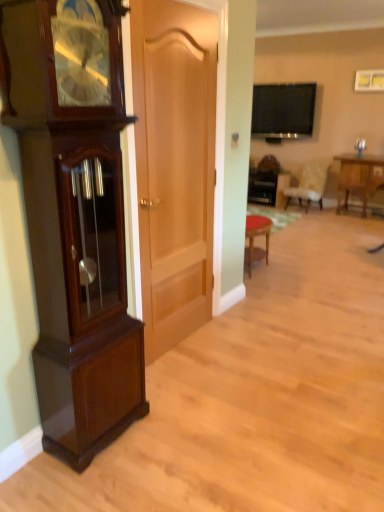
Where is `wooden table at center, which is counted as the first table, starting from the back`? The height and width of the screenshot is (512, 384). wooden table at center, which is counted as the first table, starting from the back is located at coordinates 267,187.

Identify the location of wooden table at right, marked as the second table in a back-to-front arrangement. The height and width of the screenshot is (512, 384). (358, 177).

Can you confirm if wooden table at right, the first table viewed from the front, is wider than mahogany wood grandfather clock at left?

Indeed, wooden table at right, the first table viewed from the front, has a greater width compared to mahogany wood grandfather clock at left.

From the image's perspective, is wooden table at right, the first table viewed from the front, below mahogany wood grandfather clock at left?

No, from the image's perspective, wooden table at right, the first table viewed from the front, is not below mahogany wood grandfather clock at left.

From a real-world perspective, which object stands above the other?

In real-world perspective, mahogany wood grandfather clock at left is above.

Can you tell me how much mahogany wood grandfather clock at left and flat-screen tv at upper center differ in facing direction?

There is a 93.2-degree angle between the facing directions of mahogany wood grandfather clock at left and flat-screen tv at upper center.

From the image's perspective, does mahogany wood grandfather clock at left appear lower than flat-screen tv at upper center?

Yes.

Which object is closer to the camera, mahogany wood grandfather clock at left or flat-screen tv at upper center?

mahogany wood grandfather clock at left is more forward.

Which object is positioned more to the left, mahogany wood grandfather clock at left or flat-screen tv at upper center?

From the viewer's perspective, mahogany wood grandfather clock at left appears more on the left side.

Considering the sizes of wooden table at right, the first table viewed from the right, and wooden table at center, which is counted as the first table, starting from the back, in the image, is wooden table at right, the first table viewed from the right, wider or thinner than wooden table at center, which is counted as the first table, starting from the back,?

Clearly, wooden table at right, the first table viewed from the right, has more width compared to wooden table at center, which is counted as the first table, starting from the back.

Which object is closer to the camera taking this photo, wooden table at right, which is the second table in left-to-right order, or wooden table at center, the 2th table positioned from the right?

Positioned in front is wooden table at right, which is the second table in left-to-right order.

Is wooden table at right, the first table viewed from the front, outside of wooden table at center, which is counted as the first table, starting from the back?

That's correct, wooden table at right, the first table viewed from the front, is outside of wooden table at center, which is counted as the first table, starting from the back.

How different are the orientations of wooden table at right, the first table viewed from the front, and wooden table at center, positioned as the first table in left-to-right order, in degrees?

The angle between the facing direction of wooden table at right, the first table viewed from the front, and the facing direction of wooden table at center, positioned as the first table in left-to-right order, is 3.08 degrees.

Between light brown wood door at center and wooden table at right, the first table viewed from the front, which one has more height?

light brown wood door at center is taller.

Is light brown wood door at center aimed at wooden table at right, marked as the second table in a back-to-front arrangement?

No, light brown wood door at center is not facing towards wooden table at right, marked as the second table in a back-to-front arrangement.

What's the angular difference between light brown wood door at center and wooden table at right, the first table viewed from the front,'s facing directions?

90 degrees.

Based on their positions, is wooden table at right, the first table viewed from the front, located to the left or right of light beige fabric chair at center?

wooden table at right, the first table viewed from the front, is positioned on light beige fabric chair at center's right side.

What's the angular difference between wooden table at right, the first table viewed from the front, and light beige fabric chair at center's facing directions?

wooden table at right, the first table viewed from the front, and light beige fabric chair at center are facing 10.9 degrees away from each other.

Between point (350, 188) and point (298, 199), which one is positioned in front?

The point (350, 188) is more forward.

Are wooden table at right, which is the second table in left-to-right order, and light beige fabric chair at center beside each other?

No, wooden table at right, which is the second table in left-to-right order, is not next to light beige fabric chair at center.

From the picture: Can you confirm if wooden table at center, positioned as the first table in left-to-right order, is taller than flat-screen tv at upper center?

No, wooden table at center, positioned as the first table in left-to-right order, is not taller than flat-screen tv at upper center.

Where is `television that appears on the right of wooden table at center, which appears as the second table when viewed from the front`? television that appears on the right of wooden table at center, which appears as the second table when viewed from the front is located at coordinates point(283,110).

From the image's perspective, is wooden table at center, positioned as the first table in left-to-right order, located above flat-screen tv at upper center?

No, from the image's perspective, wooden table at center, positioned as the first table in left-to-right order, is not on top of flat-screen tv at upper center.

Would you say flat-screen tv at upper center is part of wooden table at center, the 2th table positioned from the right,'s contents?

Definitely not — flat-screen tv at upper center is not inside wooden table at center, the 2th table positioned from the right.

Can you tell me how much wooden table at center, which appears as the second table when viewed from the front, and light brown wood door at center differ in facing direction?

86.9 degrees separate the facing orientations of wooden table at center, which appears as the second table when viewed from the front, and light brown wood door at center.

In the image, is wooden table at center, positioned as the first table in left-to-right order, on the left side or the right side of light brown wood door at center?

wooden table at center, positioned as the first table in left-to-right order, is to the right of light brown wood door at center.

Is point (277, 191) in front of point (171, 154)?

No, (277, 191) is behind (171, 154).

Is wooden table at center, which is counted as the first table, starting from the back, inside the boundaries of light brown wood door at center, or outside?

wooden table at center, which is counted as the first table, starting from the back, lies outside light brown wood door at center.

From the image's perspective, count 1st tables upward from the mahogany wood grandfather clock at left and point to it. Please provide its 2D coordinates.

[(358, 177)]

Find the location of a particular element. The width and height of the screenshot is (384, 512). cabinetry below the flat-screen tv at upper center (from a real-world perspective) is located at coordinates (74, 222).

Looking at the image, which one is located closer to wooden table at center, which is counted as the first table, starting from the back, light beige fabric chair at center or light brown wood door at center?

Among the two, light beige fabric chair at center is located nearer to wooden table at center, which is counted as the first table, starting from the back.

Estimate the real-world distances between objects in this image. Which object is closer to flat-screen tv at upper center, wooden table at right, the first table viewed from the front, or mahogany wood grandfather clock at left?

The object closer to flat-screen tv at upper center is wooden table at right, the first table viewed from the front.

Based on their spatial positions, is wooden table at right, the first table viewed from the front, or light beige fabric chair at center closer to mahogany wood grandfather clock at left?

Based on the image, light beige fabric chair at center appears to be nearer to mahogany wood grandfather clock at left.

Which object lies nearer to the anchor point wooden table at right, which is the second table in left-to-right order, light brown wood door at center or wooden table at center, the 2th table positioned from the right?

wooden table at center, the 2th table positioned from the right, is positioned closer to the anchor wooden table at right, which is the second table in left-to-right order.

Looking at the image, which one is located closer to wooden table at right, the first table viewed from the right, flat-screen tv at upper center or wooden table at center, positioned as the first table in left-to-right order?

wooden table at center, positioned as the first table in left-to-right order, is positioned closer to the anchor wooden table at right, the first table viewed from the right.

Estimate the real-world distances between objects in this image. Which object is closer to mahogany wood grandfather clock at left, wooden table at right, the first table viewed from the front, or light brown wood door at center?

Based on the image, light brown wood door at center appears to be nearer to mahogany wood grandfather clock at left.

Based on their spatial positions, is light brown wood door at center or flat-screen tv at upper center further from wooden table at center, which is counted as the first table, starting from the back?

light brown wood door at center is further to wooden table at center, which is counted as the first table, starting from the back.

From the image, which object appears to be farther from mahogany wood grandfather clock at left, wooden table at center, positioned as the first table in left-to-right order, or wooden table at right, the first table viewed from the front?

Among the two, wooden table at right, the first table viewed from the front, is located further to mahogany wood grandfather clock at left.

The width and height of the screenshot is (384, 512). In order to click on television between light brown wood door at center and wooden table at center, which is counted as the first table, starting from the back, from front to back in this screenshot , I will do `click(283, 110)`.

Identify the location of chair located between wooden table at center, which is counted as the first table, starting from the back, and wooden table at right, marked as the second table in a back-to-front arrangement, in the left-right direction. This screenshot has width=384, height=512. (309, 185).

Find the location of a particular element. door between mahogany wood grandfather clock at left and light beige fabric chair at center along the z-axis is located at coordinates (174, 165).

Where is `table located between mahogany wood grandfather clock at left and flat-screen tv at upper center in the depth direction`? The width and height of the screenshot is (384, 512). table located between mahogany wood grandfather clock at left and flat-screen tv at upper center in the depth direction is located at coordinates (358, 177).